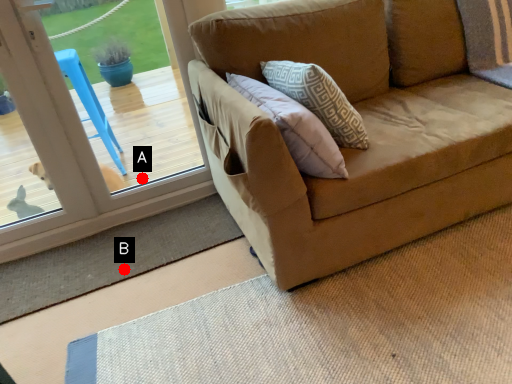
Question: Two points are circled on the image, labeled by A and B beside each circle. Among these points, which one is nearest to the camera?

Choices:
 (A) A is closer
 (B) B is closer

Answer: (B)